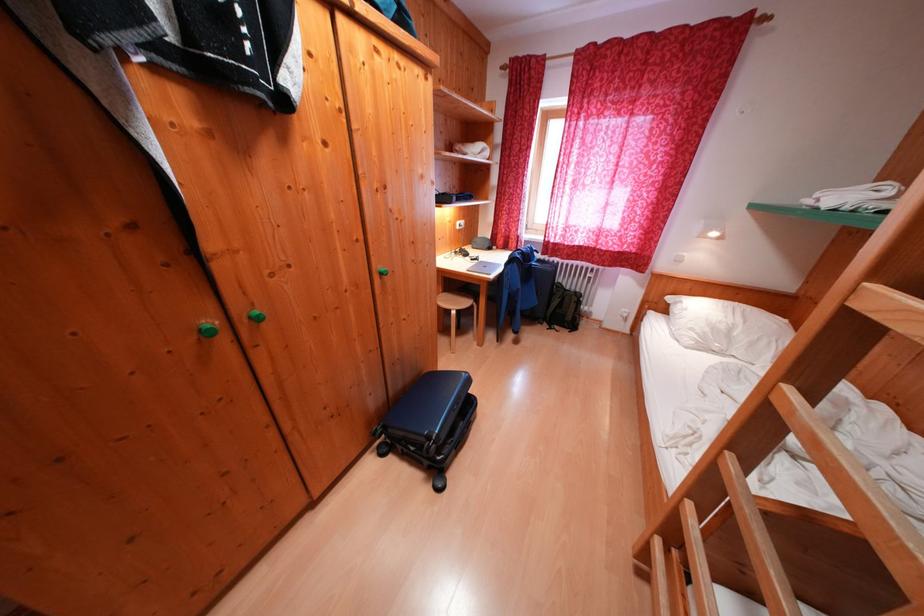
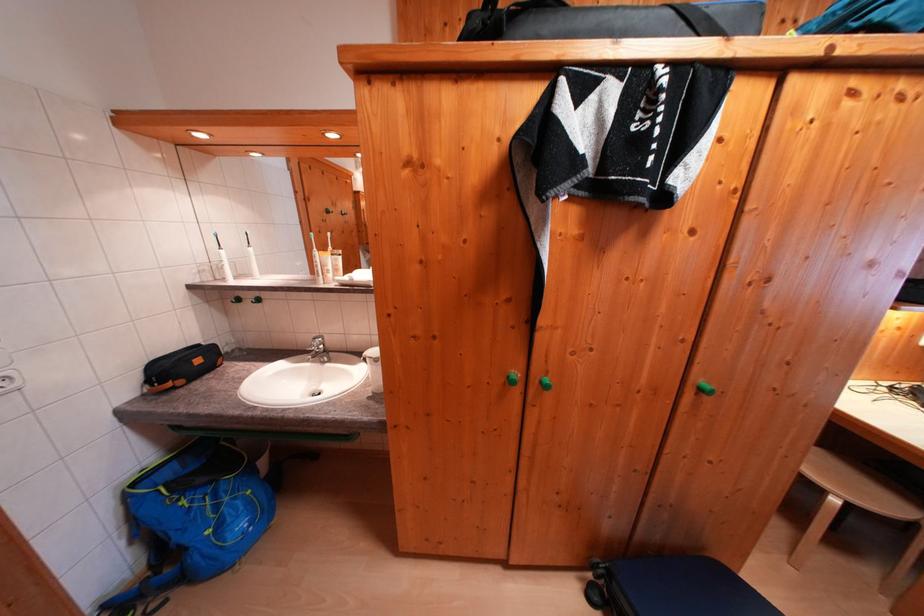
Where in the second image is the point corresponding to [201,342] from the first image?

(511, 384)